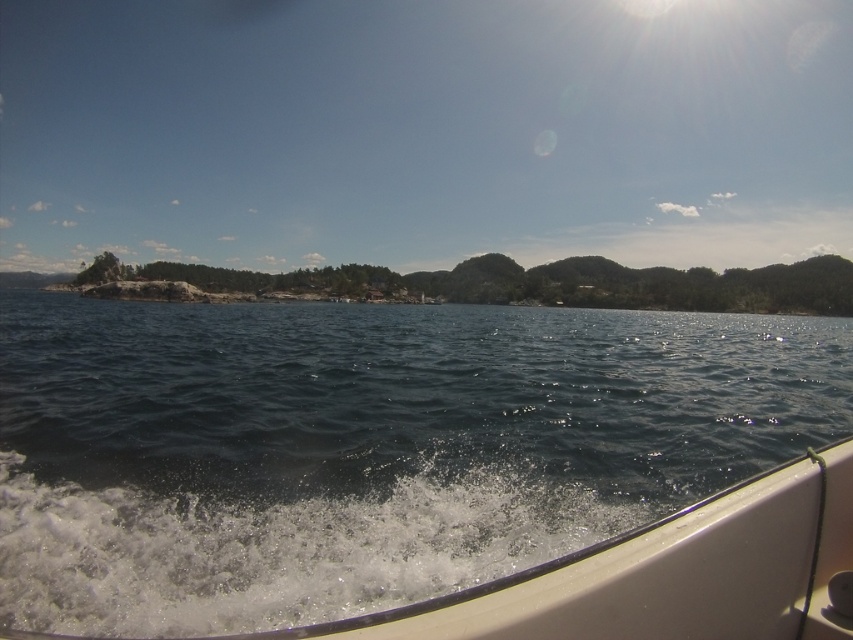
Question: Where is dark blue water at center located in relation to transparent blue sky at upper center in the image?

Choices:
 (A) below
 (B) above

Answer: (A)

Question: Can you confirm if dark blue water at center is positioned below transparent blue sky at upper center?

Choices:
 (A) no
 (B) yes

Answer: (B)

Question: Is dark blue water at center closer to camera compared to transparent blue sky at upper center?

Choices:
 (A) yes
 (B) no

Answer: (A)

Question: Which of the following is the farthest from the observer?

Choices:
 (A) (811, 188)
 (B) (39, 548)

Answer: (A)

Question: Which of the following is the farthest from the observer?

Choices:
 (A) (706, 109)
 (B) (618, 406)

Answer: (A)